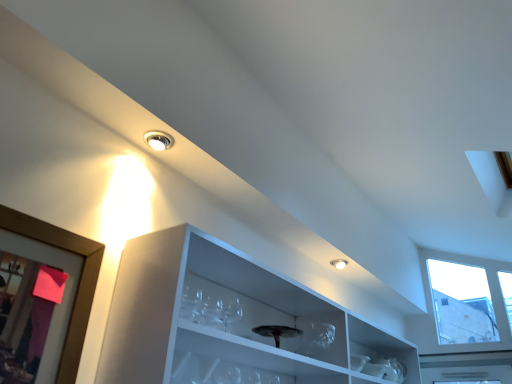
Question: From a real-world perspective, is matte white droplight at upper center physically located above or below wooden picture frame at left?

Choices:
 (A) below
 (B) above

Answer: (B)

Question: In terms of height, does matte white droplight at upper center look taller or shorter compared to wooden picture frame at left?

Choices:
 (A) tall
 (B) short

Answer: (B)

Question: Considering the real-world distances, which object is farthest from the wooden picture frame at left?

Choices:
 (A) clear glass wine glass at center
 (B) matte white droplight at upper center

Answer: (A)

Question: Estimate the real-world distances between objects in this image. Which object is closer to the matte white droplight at upper center?

Choices:
 (A) wooden picture frame at left
 (B) clear glass wine glass at center

Answer: (A)